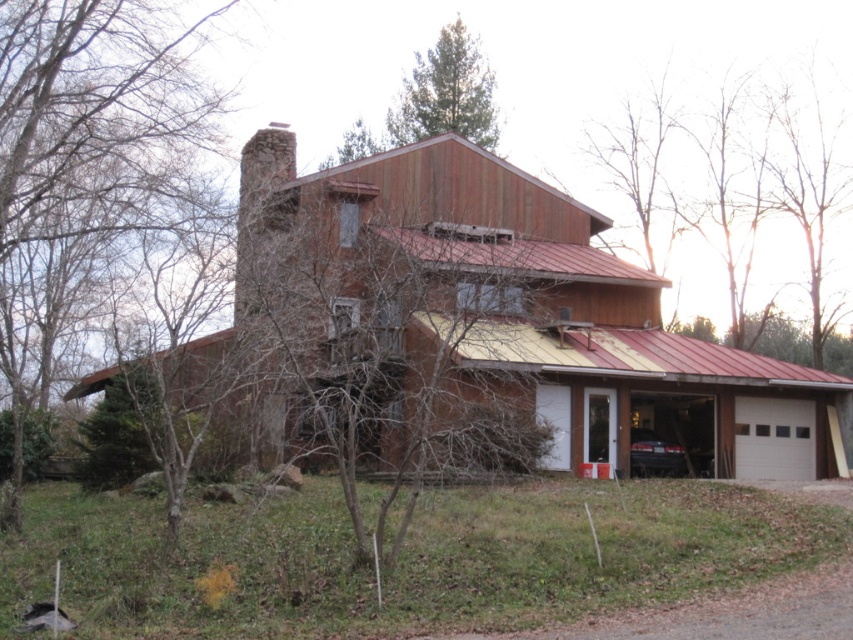
Question: Does green leafy tree at left have a greater width compared to green textured pine tree at upper center?

Choices:
 (A) no
 (B) yes

Answer: (B)

Question: Does green leafy tree at left appear under green textured pine tree at upper center?

Choices:
 (A) no
 (B) yes

Answer: (B)

Question: Does green leafy tree at left have a greater width compared to green textured pine tree at upper center?

Choices:
 (A) yes
 (B) no

Answer: (A)

Question: Which point is closer to the camera?

Choices:
 (A) 4,259
 (B) 479,125

Answer: (A)

Question: Which of the following is the farthest from the observer?

Choices:
 (A) green leafy tree at left
 (B) green textured pine tree at upper center

Answer: (B)